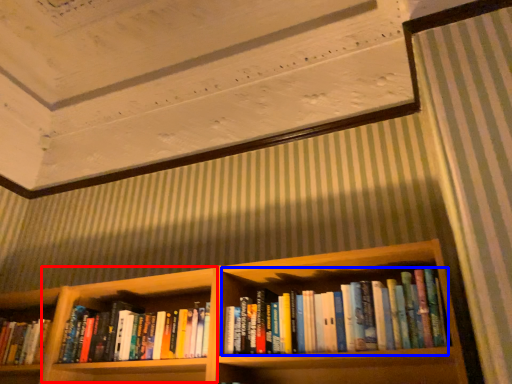
Question: Which object is closer to the camera taking this photo, cabinet (highlighted by a red box) or book (highlighted by a blue box)?

Choices:
 (A) cabinet
 (B) book

Answer: (B)